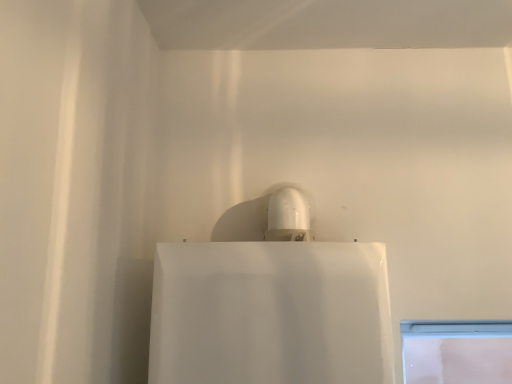
You are a GUI agent. You are given a task and a screenshot of the screen. Output one action in this format:
    pyautogui.click(x=<x>, y=<y>)
    Task: Click on the white glossy sink at upper center
    The width and height of the screenshot is (512, 384).
    Given the screenshot: What is the action you would take?
    pyautogui.click(x=270, y=303)

What is the approximate height of white glossy sink at upper center?

white glossy sink at upper center is 20.40 inches in height.

The image size is (512, 384). Describe the element at coordinates (270, 303) in the screenshot. I see `white glossy sink at upper center` at that location.

At what (x,y) coordinates should I click in order to perform the action: click on white glossy sink at upper center. Please return your answer as a coordinate pair (x, y). Looking at the image, I should click on (270, 303).